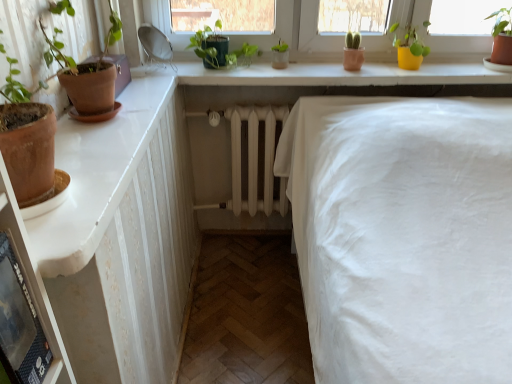
The width and height of the screenshot is (512, 384). I want to click on vacant space to the left of yellow matte pot at upper right, positioned as the 2th houseplant in left-to-right order, so click(x=371, y=70).